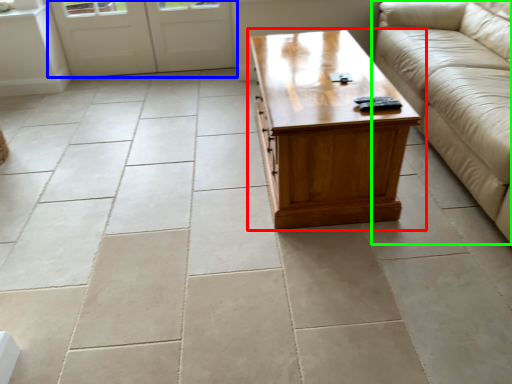
Question: Which object is positioned farthest from coffee table (highlighted by a red box)? Select from door (highlighted by a blue box) and studio couch (highlighted by a green box).

Choices:
 (A) door
 (B) studio couch

Answer: (A)